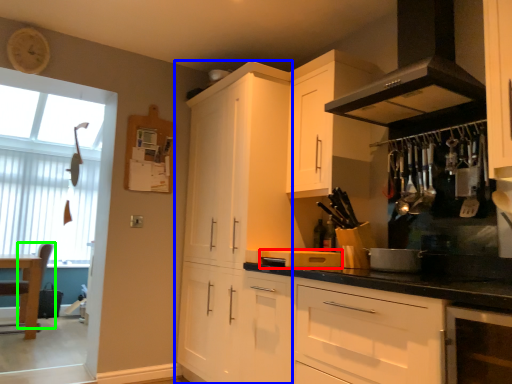
Question: Based on their relative distances, which object is nearer to appliance (highlighted by a red box)? Choose from cabinetry (highlighted by a blue box) and chair (highlighted by a green box).

Choices:
 (A) cabinetry
 (B) chair

Answer: (A)